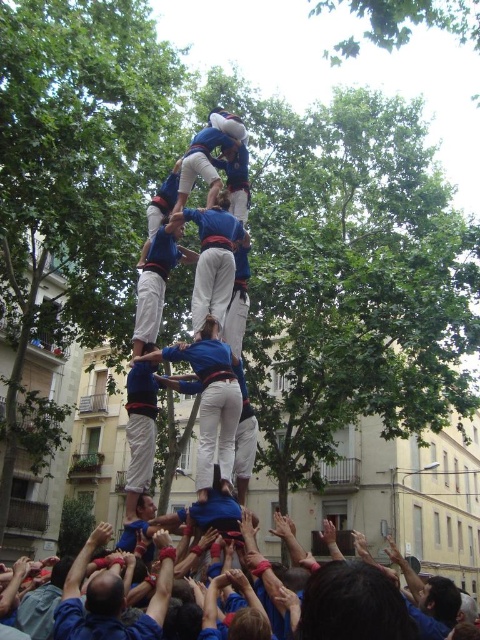
Question: Does blue fabric human at center appear on the right side of blue fabric hands at lower center?

Choices:
 (A) no
 (B) yes

Answer: (B)

Question: Is blue fabric human at center to the left of blue fabric hands at lower center from the viewer's perspective?

Choices:
 (A) yes
 (B) no

Answer: (B)

Question: Which of the following is the closest to the observer?

Choices:
 (A) blue fabric human at center
 (B) blue fabric hands at lower center

Answer: (B)

Question: Among these objects, which one is farthest from the camera?

Choices:
 (A) blue fabric hands at lower center
 (B) blue fabric human at center

Answer: (B)

Question: Can you confirm if blue fabric human at center is positioned to the right of blue fabric hands at lower center?

Choices:
 (A) no
 (B) yes

Answer: (B)